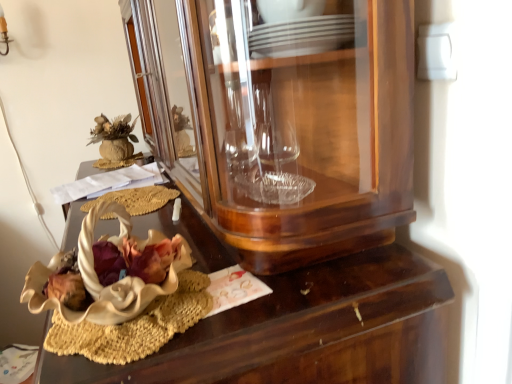
Where is `wooden desk at center`? The width and height of the screenshot is (512, 384). wooden desk at center is located at coordinates (305, 331).

Locate an element on the screen. This screenshot has width=512, height=384. transparent glass cabinet at center is located at coordinates (288, 126).

Is transparent glass cabinet at center facing away from white matte flower at center?

No.

Between transparent glass cabinet at center and white matte flower at center, which one is positioned in front?

transparent glass cabinet at center.

Which object is thinner, transparent glass cabinet at center or white matte flower at center?

white matte flower at center.

Which of these two, wooden desk at center or white matte flower at center, is smaller?

white matte flower at center is smaller.

Which is in front, point (208, 350) or point (159, 185)?

The point (208, 350) is closer to the camera.

In the scene shown: Can you tell me how much wooden desk at center and white matte flower at center differ in facing direction?

The angular difference between wooden desk at center and white matte flower at center is 0.00165 degrees.

Is wooden desk at center oriented towards white matte flower at center?

No, wooden desk at center is not aimed at white matte flower at center.

Is wooden desk at center shorter than transparent glass cabinet at center?

No.

How much distance is there between wooden desk at center and transparent glass cabinet at center?

wooden desk at center is 8.32 inches away from transparent glass cabinet at center.

Where is `cabinetry above the wooden desk at center (from the image's perspective)`? This screenshot has width=512, height=384. cabinetry above the wooden desk at center (from the image's perspective) is located at coordinates (288, 126).

Choose the correct answer: Is wooden desk at center inside transparent glass cabinet at center or outside it?

wooden desk at center is outside transparent glass cabinet at center.

From a real-world perspective, which is physically above, transparent glass cabinet at center or wooden desk at center?

From a 3D spatial view, transparent glass cabinet at center is above.

From the picture: From the image's perspective, who appears lower, transparent glass cabinet at center or wooden desk at center?

Answer: wooden desk at center appears lower in the image.

How distant is transparent glass cabinet at center from wooden desk at center?

The distance of transparent glass cabinet at center from wooden desk at center is 8.32 inches.

Considering the sizes of transparent glass cabinet at center and wooden desk at center in the image, is transparent glass cabinet at center wider or thinner than wooden desk at center?

transparent glass cabinet at center is thinner than wooden desk at center.

From the image's perspective, is white matte flower at center above or below wooden desk at center?

Clearly, from the image's perspective, white matte flower at center is above wooden desk at center.

Considering the sizes of white matte flower at center and wooden desk at center in the image, is white matte flower at center wider or thinner than wooden desk at center?

white matte flower at center is thinner than wooden desk at center.

This screenshot has height=384, width=512. In order to click on desk to the right of white matte flower at center in this screenshot , I will do (305, 331).

Considering the relative sizes of white matte flower at center and wooden desk at center in the image provided, is white matte flower at center bigger than wooden desk at center?

No.

This screenshot has height=384, width=512. Find the location of `cabinetry above the white matte flower at center (from a real-world perspective)`. cabinetry above the white matte flower at center (from a real-world perspective) is located at coordinates (288, 126).

From a real-world perspective, between white matte flower at center and transparent glass cabinet at center, who is vertically higher?

transparent glass cabinet at center.

Is white matte flower at center facing away from transparent glass cabinet at center?

That's right, white matte flower at center is facing away from transparent glass cabinet at center.

Is white matte flower at center completely or partially outside of transparent glass cabinet at center?

Yes, white matte flower at center is not within transparent glass cabinet at center.

Image resolution: width=512 pixels, height=384 pixels. I want to click on cabinetry lying in front of the white matte flower at center, so click(288, 126).

You are a GUI agent. You are given a task and a screenshot of the screen. Output one action in this format:
    pyautogui.click(x=<x>, y=<y>)
    Task: Click on the desk lying on the right of white matte flower at center
    This screenshot has height=384, width=512.
    Given the screenshot: What is the action you would take?
    pyautogui.click(x=305, y=331)

When comparing their distances from white matte flower at center, does transparent glass cabinet at center or wooden desk at center seem closer?

wooden desk at center is positioned closer to the anchor white matte flower at center.

Considering their positions, is white matte flower at center positioned closer to wooden desk at center than transparent glass cabinet at center?

Among the two, transparent glass cabinet at center is located nearer to wooden desk at center.

Based on the photo, when comparing their distances from wooden desk at center, does transparent glass cabinet at center or white matte flower at center seem further?

Based on the image, white matte flower at center appears to be further to wooden desk at center.

When comparing their distances from transparent glass cabinet at center, does wooden desk at center or white matte flower at center seem further?

white matte flower at center.

Looking at the image, which one is located further to transparent glass cabinet at center, white matte flower at center or wooden desk at center?

white matte flower at center.

Based on their spatial positions, is wooden desk at center or transparent glass cabinet at center closer to white matte flower at center?

The object closer to white matte flower at center is wooden desk at center.

Identify the location of food between transparent glass cabinet at center and wooden desk at center in the up-down direction. The width and height of the screenshot is (512, 384). (137, 199).